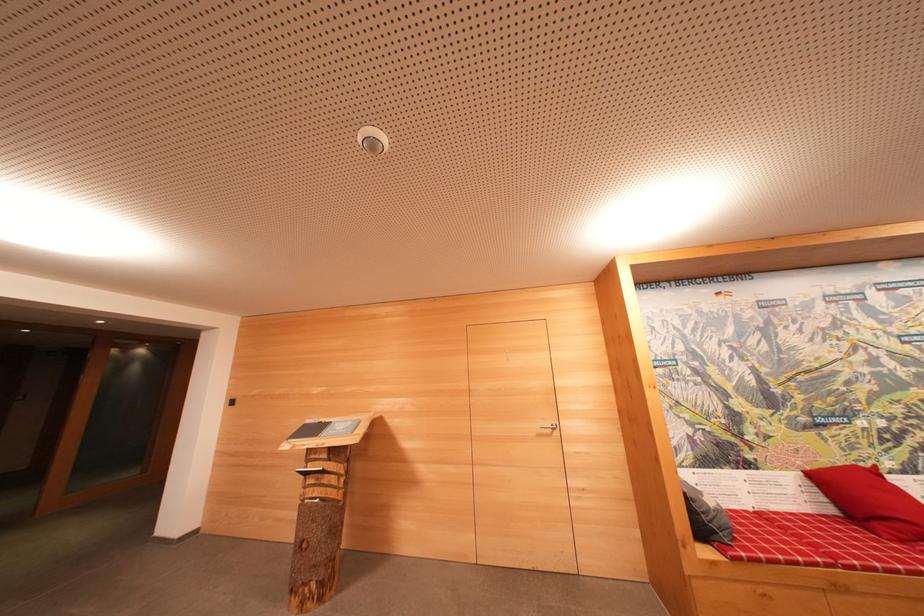
The image size is (924, 616). Find the location of `sofa sitting surface`. sofa sitting surface is located at coordinates (816, 543).